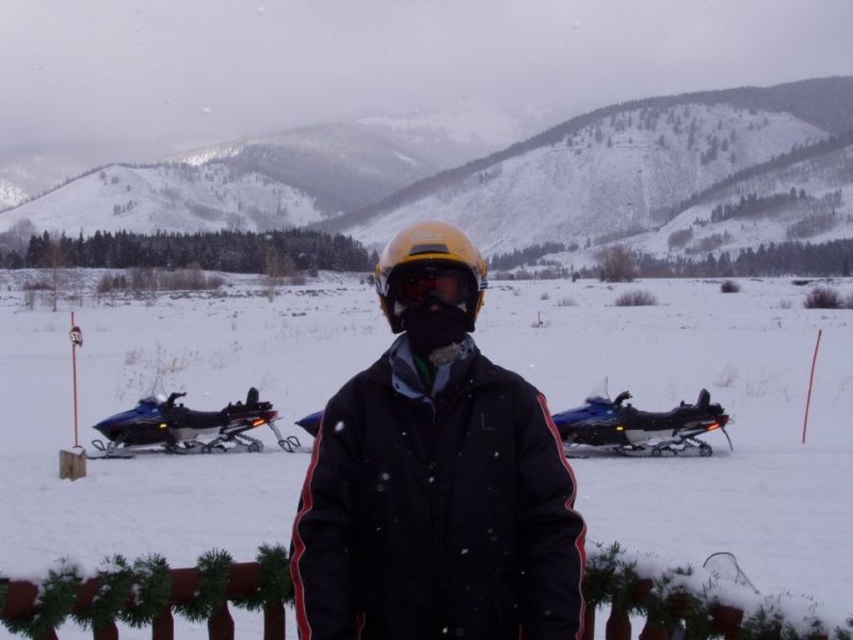
Question: Based on their relative distances, which object is farther from the matte black jacket at center?

Choices:
 (A) matte yellow goggles at center
 (B) blue metallic snowmobile at left
 (C) blue plastic snowmobile at center

Answer: (B)

Question: Which object is positioned farthest from the matte yellow goggles at center?

Choices:
 (A) white fluffy snow at center
 (B) blue metallic snowmobile at left
 (C) blue plastic snowmobile at center

Answer: (A)

Question: From the image, what is the correct spatial relationship of yellow matte helmet at center in relation to blue plastic snowmobile at center?

Choices:
 (A) above
 (B) below

Answer: (A)

Question: Can you confirm if blue metallic snowmobile at left is wider than matte yellow goggles at center?

Choices:
 (A) yes
 (B) no

Answer: (A)

Question: Does white fluffy snow at center have a larger size compared to matte black jacket at center?

Choices:
 (A) no
 (B) yes

Answer: (B)

Question: Estimate the real-world distances between objects in this image. Which object is closer to the white fluffy snow at center?

Choices:
 (A) matte black jacket at center
 (B) matte yellow goggles at center
 (C) yellow matte helmet at center

Answer: (B)